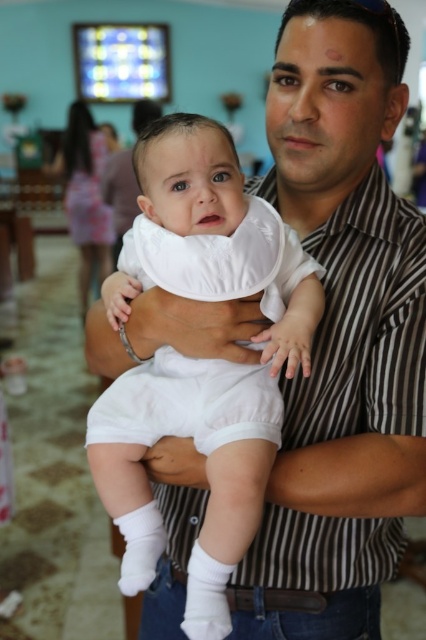
Question: Does white soft bib at center have a smaller size compared to white striped shirt at center?

Choices:
 (A) no
 (B) yes

Answer: (B)

Question: Which point appears farthest from the camera in this image?

Choices:
 (A) (298, 275)
 (B) (238, 579)

Answer: (B)

Question: Is white soft bib at center to the right of white striped shirt at center from the viewer's perspective?

Choices:
 (A) no
 (B) yes

Answer: (A)

Question: Is white soft bib at center further to camera compared to white striped shirt at center?

Choices:
 (A) no
 (B) yes

Answer: (A)

Question: Which point is farther to the camera?

Choices:
 (A) white striped shirt at center
 (B) white soft bib at center

Answer: (A)

Question: Which object is closer to the camera taking this photo?

Choices:
 (A) white soft bib at center
 (B) white striped shirt at center

Answer: (A)